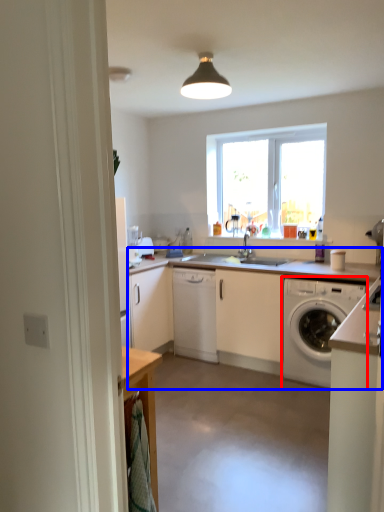
Question: Which object is further to the camera taking this photo, washing machine (highlighted by a red box) or countertop (highlighted by a blue box)?

Choices:
 (A) washing machine
 (B) countertop

Answer: (A)